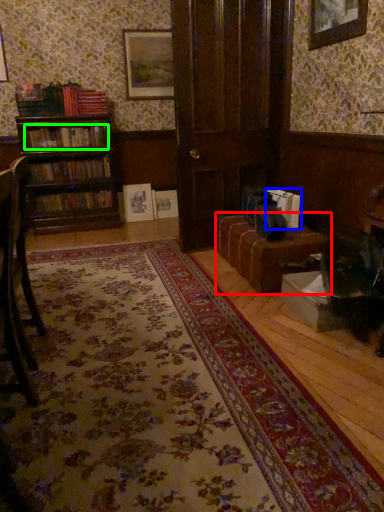
Question: Which object is positioned closest to table (highlighted by a red box)? Select from book (highlighted by a blue box) and book (highlighted by a green box).

Choices:
 (A) book
 (B) book

Answer: (A)